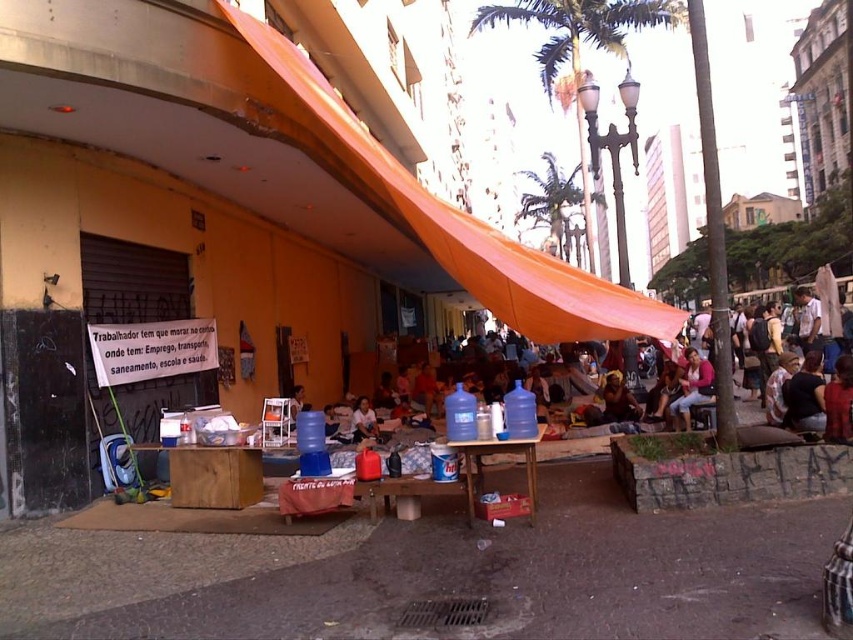
You are a photographer trying to capture a candid shot of the pink fabric shirt at center without including the wooden table at center in the frame. Based on their positions, is this possible?

The wooden table at center is positioned on the left side of pink fabric shirt at center, so if you position yourself to the right side of the pink fabric shirt at center, you can capture the shirt without the table in the frame.

Based on the scene description, where is the wooden table at center located in terms of coordinates?

The wooden table at center is located at coordinates point (496,452).

You are a city planner analyzing this urban scene. You notice a wooden table at center and a smooth plastic bottle at center. Which object is positioned higher in relation to the other?

The wooden table at center is above the smooth plastic bottle at center, so the wooden table is higher.